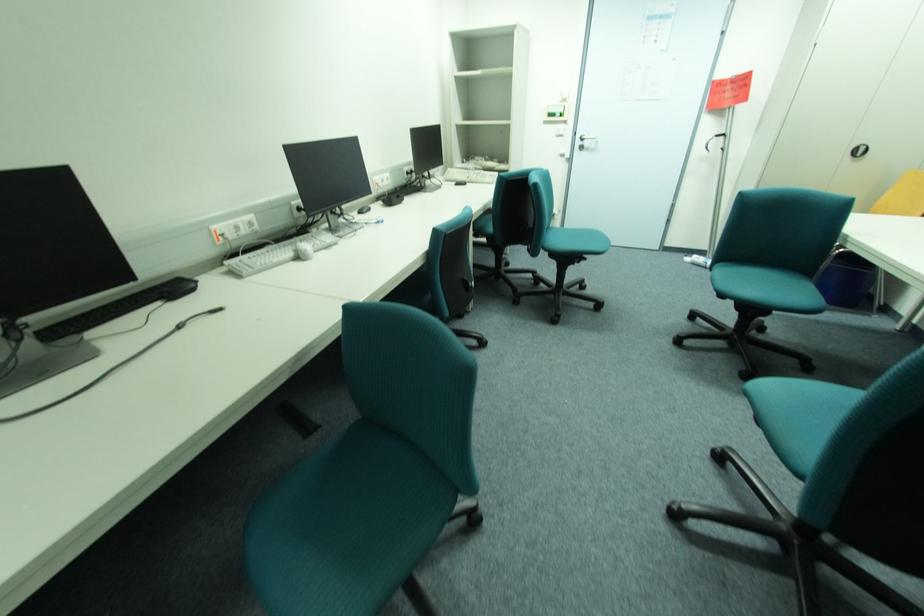
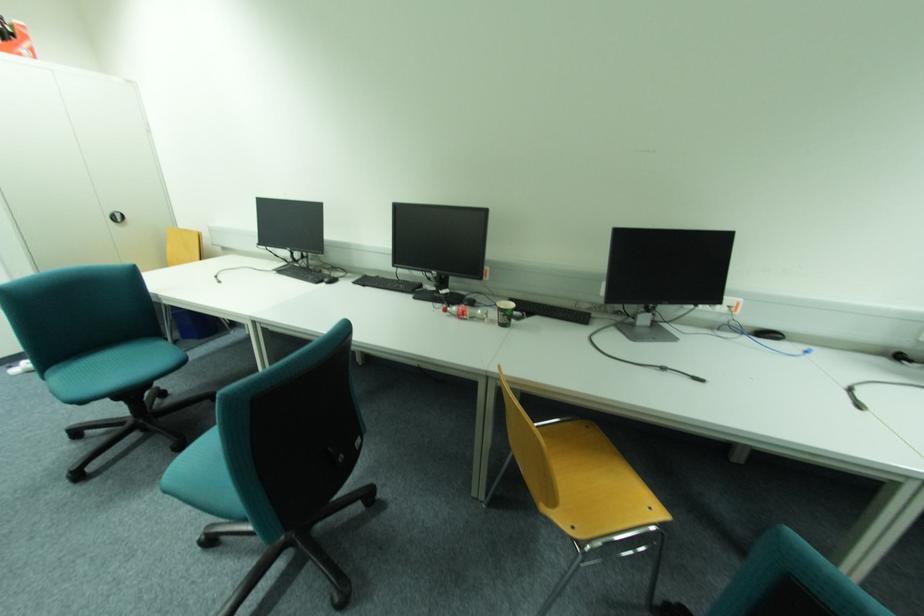
In the second image, find the point that corresponds to [867,153] in the first image.

(126, 219)